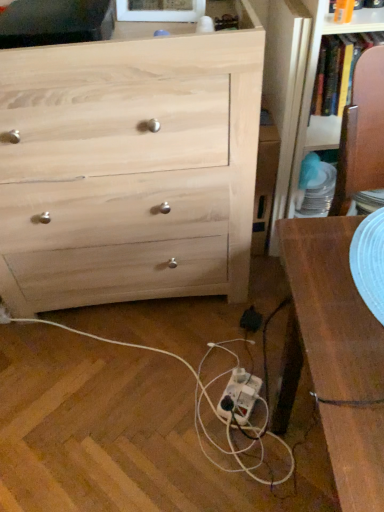
Question: Which direction should I rotate to look at white plastic extension cord at lower center?

Choices:
 (A) right
 (B) left

Answer: (A)

Question: Is white plastic extension cord at lower center facing towards white plastic power strip at lower center?

Choices:
 (A) no
 (B) yes

Answer: (B)

Question: Considering the relative positions of white plastic extension cord at lower center and white plastic power strip at lower center in the image provided, is white plastic extension cord at lower center to the right of white plastic power strip at lower center from the viewer's perspective?

Choices:
 (A) yes
 (B) no

Answer: (A)

Question: Is white plastic extension cord at lower center bigger than white plastic power strip at lower center?

Choices:
 (A) no
 (B) yes

Answer: (A)

Question: Is white plastic extension cord at lower center in contact with white plastic power strip at lower center?

Choices:
 (A) no
 (B) yes

Answer: (A)

Question: Can you confirm if white plastic extension cord at lower center is wider than white plastic power strip at lower center?

Choices:
 (A) no
 (B) yes

Answer: (A)

Question: Is white plastic extension cord at lower center shorter than white plastic power strip at lower center?

Choices:
 (A) no
 (B) yes

Answer: (A)

Question: Can you confirm if natural wood chest of drawers at upper left is thinner than white plastic power strip at lower center?

Choices:
 (A) no
 (B) yes

Answer: (B)

Question: Can you confirm if natural wood chest of drawers at upper left is positioned to the right of white plastic power strip at lower center?

Choices:
 (A) yes
 (B) no

Answer: (B)

Question: Could white plastic power strip at lower center be considered to be inside natural wood chest of drawers at upper left?

Choices:
 (A) yes
 (B) no

Answer: (B)

Question: Considering the relative sizes of natural wood chest of drawers at upper left and white plastic power strip at lower center in the image provided, is natural wood chest of drawers at upper left taller than white plastic power strip at lower center?

Choices:
 (A) yes
 (B) no

Answer: (A)

Question: Considering the relative sizes of natural wood chest of drawers at upper left and white plastic power strip at lower center in the image provided, is natural wood chest of drawers at upper left wider than white plastic power strip at lower center?

Choices:
 (A) yes
 (B) no

Answer: (B)

Question: Is natural wood chest of drawers at upper left closer to camera compared to white plastic power strip at lower center?

Choices:
 (A) yes
 (B) no

Answer: (A)

Question: Could white plastic extension cord at lower center be considered to be inside natural wood chest of drawers at upper left?

Choices:
 (A) yes
 (B) no

Answer: (B)